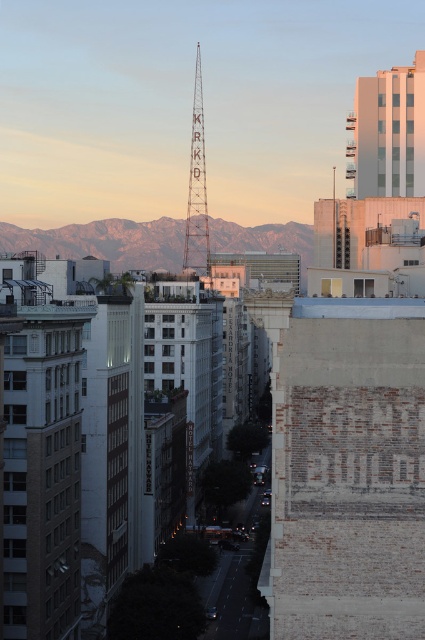
Is the position of white concrete building at upper right more distant than that of metallic silver tower at center?

No.

Does white concrete building at upper right have a greater width compared to metallic silver tower at center?

Correct, the width of white concrete building at upper right exceeds that of metallic silver tower at center.

Based on the photo, who is more forward, (413, 88) or (193, 180)?

Positioned in front is point (413, 88).

I want to click on white concrete building at upper right, so click(388, 132).

Does gray rocky mountains at center appear under metallic silver tower at center?

Indeed, gray rocky mountains at center is positioned under metallic silver tower at center.

Can you confirm if gray rocky mountains at center is taller than metallic silver tower at center?

In fact, gray rocky mountains at center may be shorter than metallic silver tower at center.

Is point (229, 236) less distant than point (197, 266)?

No, (229, 236) is further to viewer.

This screenshot has height=640, width=425. Identify the location of gray rocky mountains at center. (105, 241).

Is point (155, 236) positioned after point (371, 168)?

Yes, it is behind point (371, 168).

Does point (241, 248) come in front of point (396, 132)?

No.

At what (x,y) coordinates should I click in order to perform the action: click on gray rocky mountains at center. Please return your answer as a coordinate pair (x, y). This screenshot has width=425, height=640. Looking at the image, I should click on (105, 241).